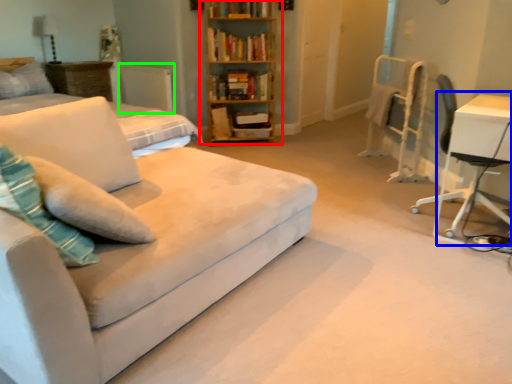
Question: Considering the real-world distances, which object is farthest from bookcase (highlighted by a red box)? table (highlighted by a blue box) or radiator (highlighted by a green box)?

Choices:
 (A) table
 (B) radiator

Answer: (A)